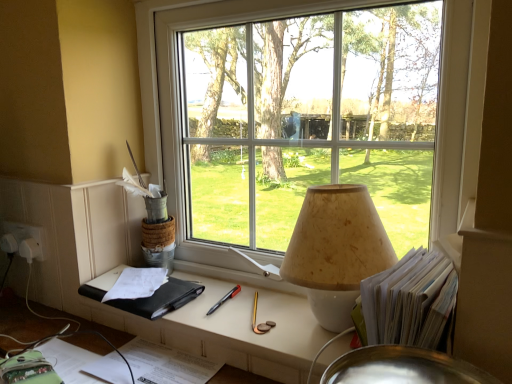
The width and height of the screenshot is (512, 384). What are the coordinates of `free point below black leather notebook at lower left (from a real-world perspective)` in the screenshot? It's located at (154, 290).